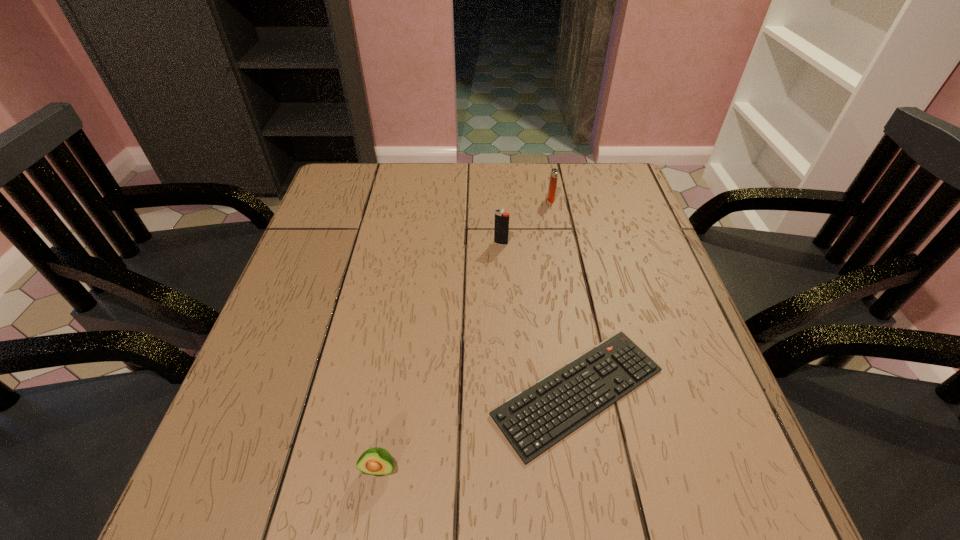
This screenshot has height=540, width=960. In the image, there is a desktop. Identify the location of vacant space at the far left corner. (376, 166).

Identify the location of vacant space at the far right corner of the desktop. (619, 168).

Find the location of `free point between the nearer igniter and the computer keyboard`. free point between the nearer igniter and the computer keyboard is located at coordinates (540, 318).

Locate an element on the screen. This screenshot has height=540, width=960. free space between the avocado and the farther igniter is located at coordinates (465, 334).

Locate an element on the screen. This screenshot has height=540, width=960. free space that is in between the second farthest object and the avocado is located at coordinates (440, 356).

Where is `vacant region between the shortest object and the farthest object`? vacant region between the shortest object and the farthest object is located at coordinates pyautogui.click(x=564, y=296).

Identify the location of empty space between the farthest object and the avocado. (465, 334).

Locate an element on the screen. The height and width of the screenshot is (540, 960). free point between the farthest object and the leftmost object is located at coordinates (465, 334).

What are the coordinates of `free spot between the left igniter and the computer keyboard` in the screenshot? It's located at (540, 318).

In order to click on free space between the nearer igniter and the third tallest object in this screenshot , I will do `click(440, 356)`.